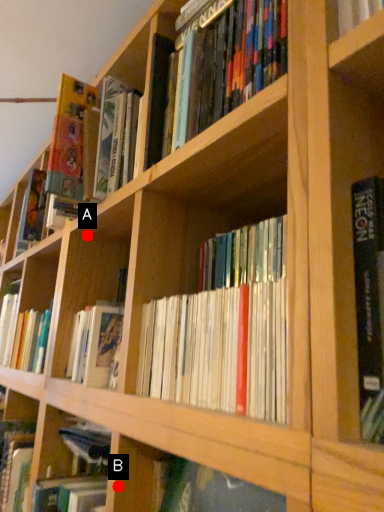
Question: Two points are circled on the image, labeled by A and B beside each circle. Among these points, which one is farthest from the camera?

Choices:
 (A) A is further
 (B) B is further

Answer: (A)